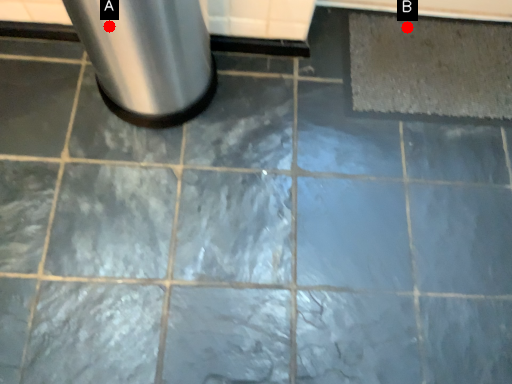
Question: Two points are circled on the image, labeled by A and B beside each circle. Which point appears farthest from the camera in this image?

Choices:
 (A) A is further
 (B) B is further

Answer: (B)